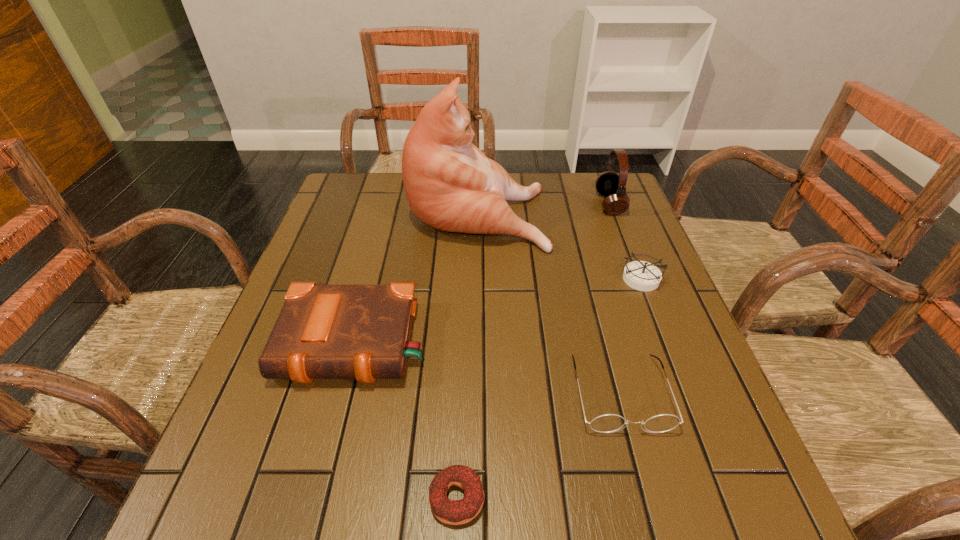
I want to click on compass at the right edge, so click(x=640, y=275).

Locate an element on the screen. spectacles present at the right edge is located at coordinates (609, 423).

Find the location of a particular element. The width and height of the screenshot is (960, 540). object at the far right corner is located at coordinates (610, 184).

Image resolution: width=960 pixels, height=540 pixels. In the image, there is a desktop. What are the coordinates of `blank space at the far edge` in the screenshot? It's located at (399, 176).

In order to click on vacant position at the left edge of the desktop in this screenshot , I will do [320, 406].

Where is `vacant space at the right edge of the desktop`? vacant space at the right edge of the desktop is located at coordinates click(x=600, y=226).

The image size is (960, 540). Identify the location of vacant space at the far left corner. (381, 186).

I want to click on blank space at the far right corner of the desktop, so click(x=582, y=177).

Where is `vacant space at the near right corner`? Image resolution: width=960 pixels, height=540 pixels. vacant space at the near right corner is located at coordinates (754, 491).

Locate an element on the screen. The image size is (960, 540). empty location between the spectacles and the second tallest object is located at coordinates (614, 299).